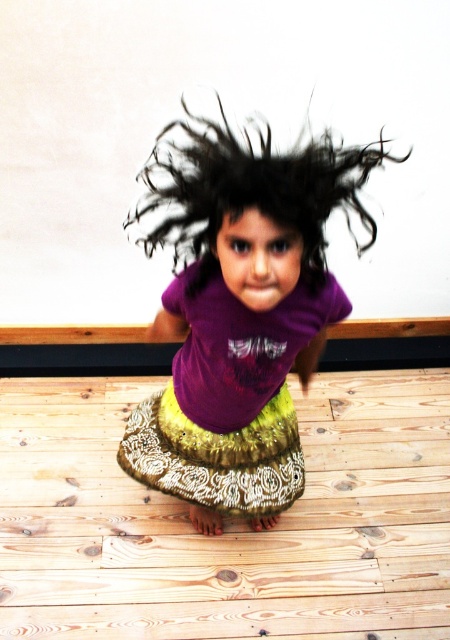
You are a photographer trying to capture the child in motion. You want to ensure that both the purple matte shirt at center and the gold sequined skirt at center are clearly visible in the photo. Given their distance apart, is there a risk that the skirt might blur if you focus on the shirt?

The purple matte shirt at center and gold sequined skirt at center are only 1.38 inches apart, so focusing on one would likely keep both in focus. There is minimal risk of blur if the camera settings are adjusted properly for such a small distance between them.

You are an artist trying to draw the child in the image. You need to decide which of the two points, point (253, 176) or point (310, 141), is closer to the viewer. Which one should you focus on to capture the depth correctly?

Point (253, 176) is closer to the viewer than point (310, 141), so you should focus on point (253, 176) to capture the depth correctly.

You are a photographer setting up a shoot in the room described. You need to ensure that the gold sequined skirt at center and the black curly hair at center are both fully visible in the frame. Based on their sizes, which object might require more space horizontally?

The gold sequined skirt at center might be wider than black curly hair at center, so it might require more horizontal space to ensure it is fully visible in the frame.